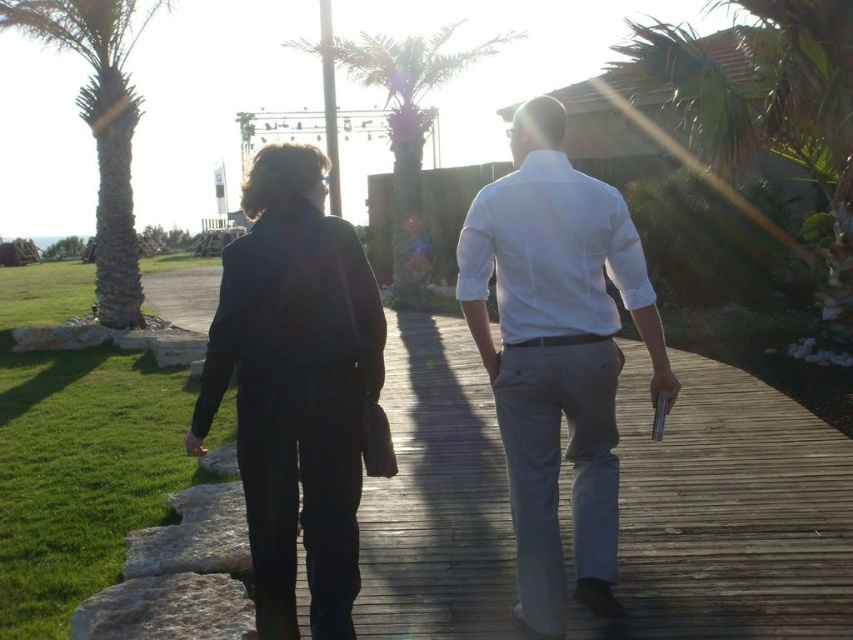
Question: Does green leafy palm tree at left have a greater width compared to green leafy palm tree at center?

Choices:
 (A) no
 (B) yes

Answer: (A)

Question: From the image, what is the correct spatial relationship of green leafy palm tree at left in relation to green leafy palm tree at center?

Choices:
 (A) right
 (B) left

Answer: (B)

Question: Which point appears farthest from the camera in this image?

Choices:
 (A) tap(253, 324)
 (B) tap(363, 76)

Answer: (B)

Question: Which of the following is the closest to the observer?

Choices:
 (A) green leafy palm tree at center
 (B) green leafy palm tree at left
 (C) white cotton shirt at center
 (D) dark blue fabric jacket at left

Answer: (D)

Question: Where is white cotton shirt at center located in relation to dark blue fabric jacket at left in the image?

Choices:
 (A) right
 (B) left

Answer: (A)

Question: Which point is closer to the camera?

Choices:
 (A) (554, 458)
 (B) (567, 404)
 (C) (338, 557)

Answer: (C)